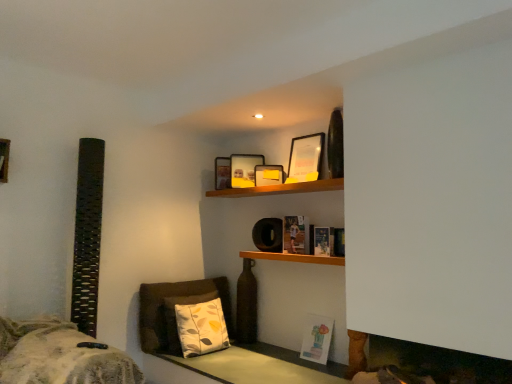
In order to click on free space below matte paper book at center, marked as the 3th book in a bottom-to-top arrangement (from a real-world perspective) in this screenshot , I will do `click(298, 252)`.